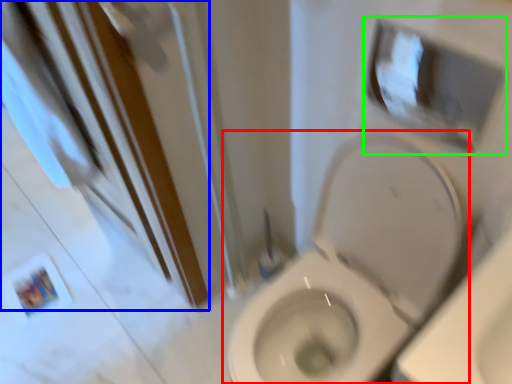
Question: Which object is positioned farthest from toilet (highlighted by a red box)? Select from screen door (highlighted by a blue box) and medicine cabinet (highlighted by a green box).

Choices:
 (A) screen door
 (B) medicine cabinet

Answer: (A)